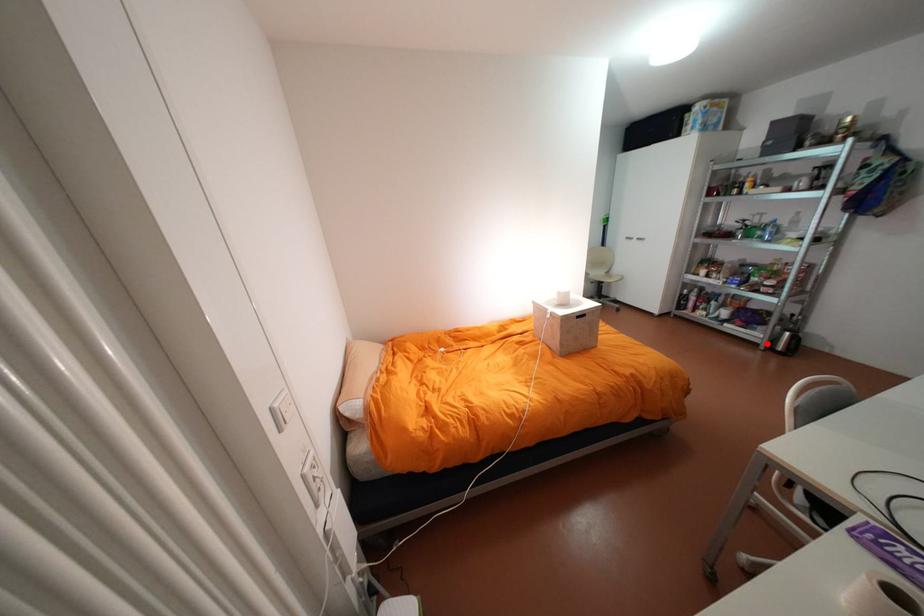
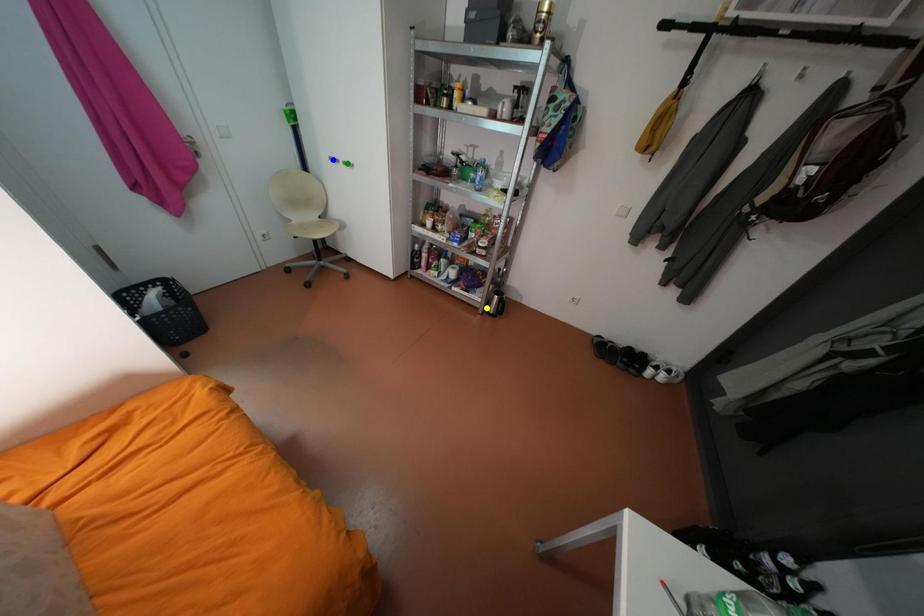
Question: I am providing you with two images of the same scene from different viewpoints. A red point is marked on the first image. You are given multiple points on the second image. In image 2, which mark is for the same physical point as the one in image 1?

Choices:
 (A) yellow point
 (B) blue point
 (C) green point

Answer: (A)